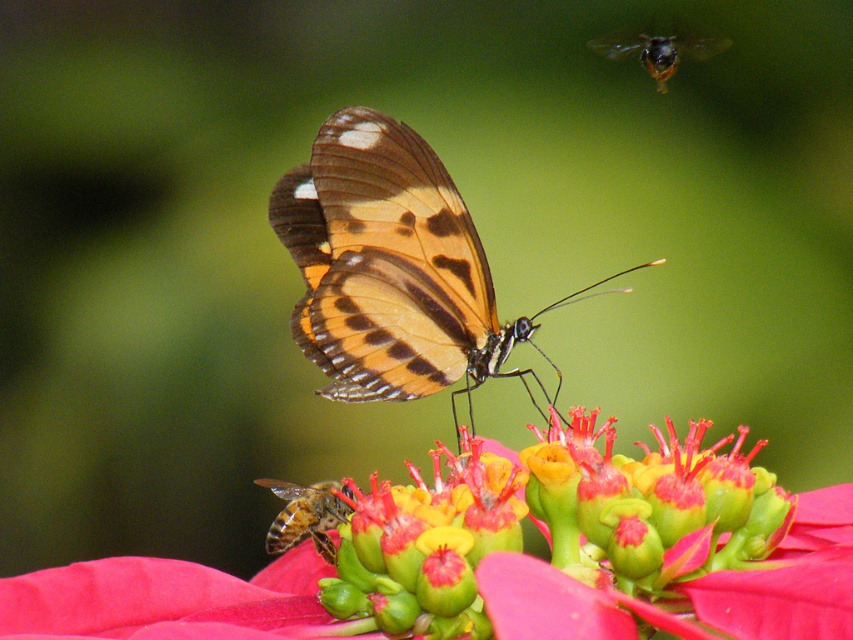
Does translucent yellow bee at lower left appear on the left side of shiny metallic bee at upper right?

Correct, you'll find translucent yellow bee at lower left to the left of shiny metallic bee at upper right.

Is translucent yellow bee at lower left above shiny metallic bee at upper right?

No, translucent yellow bee at lower left is not above shiny metallic bee at upper right.

Is point (267, 480) behind point (665, 88)?

No, it is in front of (665, 88).

Find the location of a particular element. translucent yellow bee at lower left is located at coordinates (306, 515).

Between orange-patterned butterfly at center and shiny metallic bee at upper right, which one has less height?

Standing shorter between the two is shiny metallic bee at upper right.

Is orange-patterned butterfly at center wider than shiny metallic bee at upper right?

Indeed, orange-patterned butterfly at center has a greater width compared to shiny metallic bee at upper right.

This screenshot has width=853, height=640. I want to click on orange-patterned butterfly at center, so pyautogui.click(x=392, y=268).

Based on the photo, who is shorter, smooth pink petals at center or shiny metallic bee at upper right?

Standing shorter between the two is shiny metallic bee at upper right.

Can you confirm if smooth pink petals at center is positioned to the right of shiny metallic bee at upper right?

In fact, smooth pink petals at center is to the left of shiny metallic bee at upper right.

What do you see at coordinates (495, 564) in the screenshot? I see `smooth pink petals at center` at bounding box center [495, 564].

Identify the location of smooth pink petals at center. (495, 564).